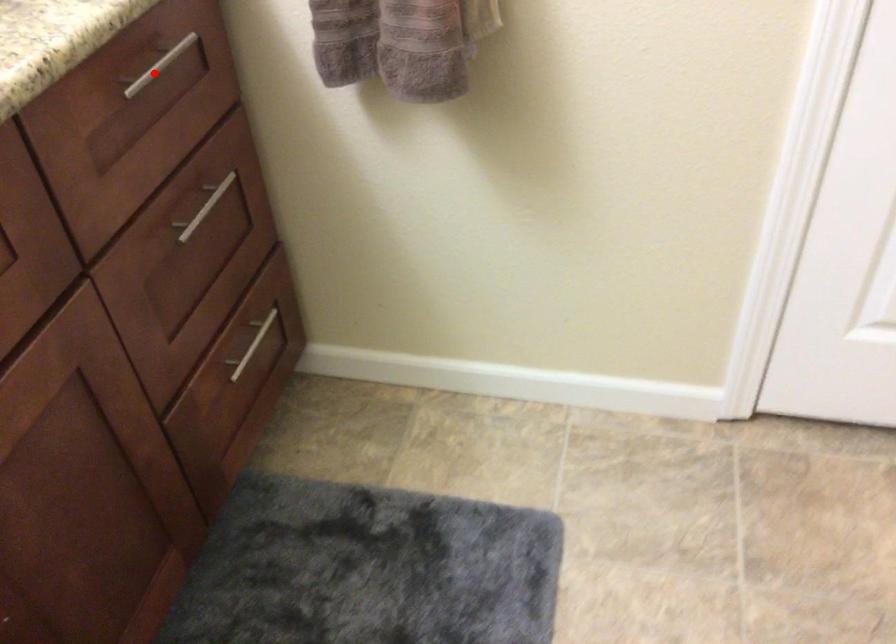
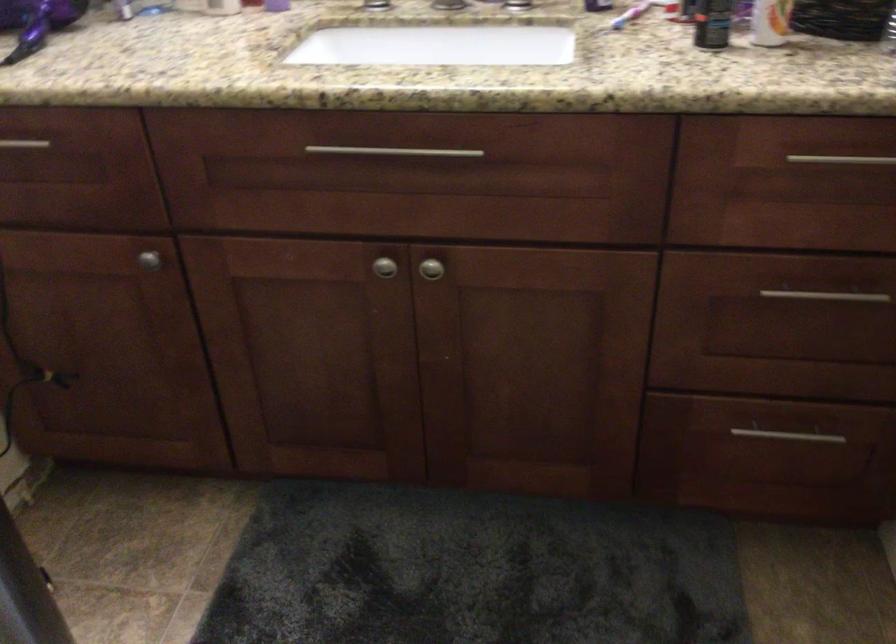
Question: I am providing you with two images of the same scene from different viewpoints. A red point is marked on the first image. At the location where the point appears in image 1, is it still visible in image 2?

Choices:
 (A) Yes
 (B) No

Answer: (A)